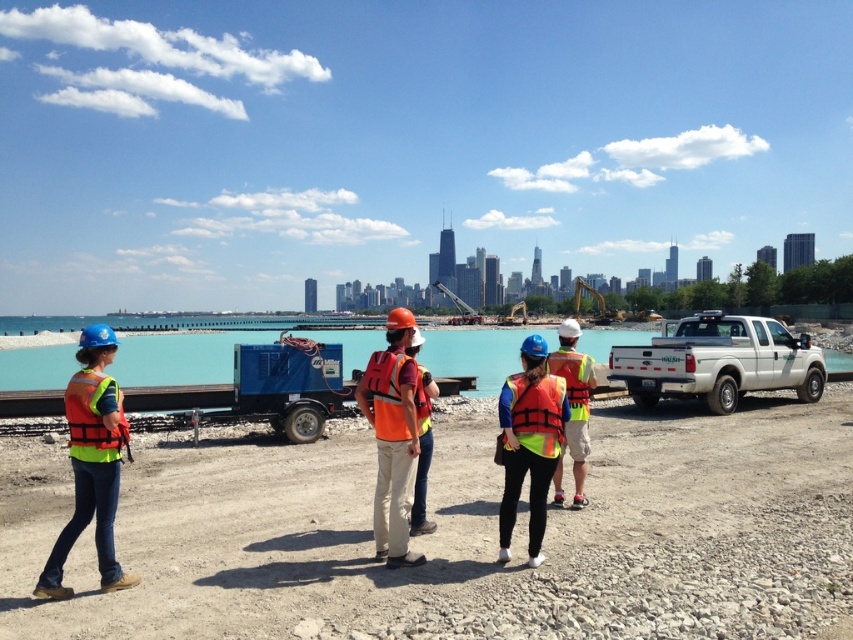
You are a delivery driver who needs to park your truck next to the reflective yellow safety vest at center. Given that your truck is the same size as the white matte truck at right, will there be enough space to park?

The white matte truck at right is larger in size than the reflective yellow safety vest at center. Since your truck is the same size as the white matte truck at right, there might not be enough space to park next to the reflective yellow safety vest at center because the existing truck is already occupying a larger area.